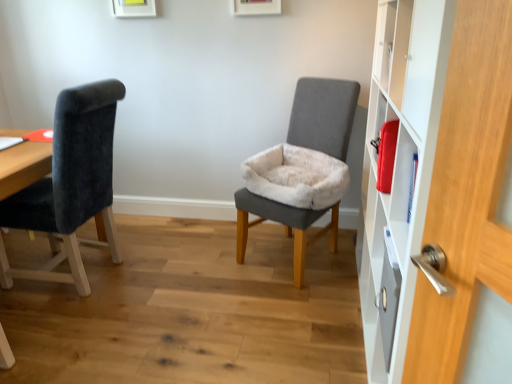
You are a GUI agent. You are given a task and a screenshot of the screen. Output one action in this format:
    pyautogui.click(x=<x>, y=<y>)
    Task: Click on the free space in front of velvet black chair at left, marked as the first chair in a left-to-right arrangement
    The image size is (512, 384).
    Given the screenshot: What is the action you would take?
    pyautogui.click(x=77, y=332)